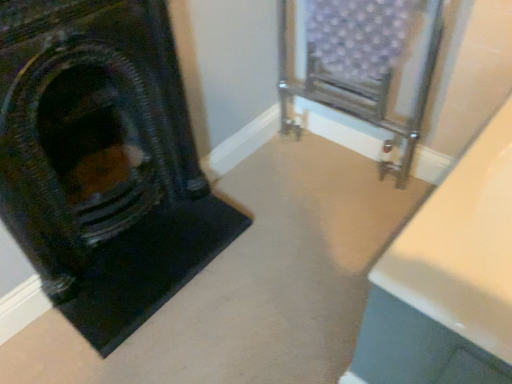
Question: Can you confirm if metallic radiator at center is bigger than matte black fireplace at left?

Choices:
 (A) no
 (B) yes

Answer: (B)

Question: Does metallic radiator at center appear on the right side of matte black fireplace at left?

Choices:
 (A) yes
 (B) no

Answer: (A)

Question: Is metallic radiator at center surrounding matte black fireplace at left?

Choices:
 (A) yes
 (B) no

Answer: (B)

Question: Considering the relative positions of metallic radiator at center and matte black fireplace at left in the image provided, is metallic radiator at center to the left of matte black fireplace at left from the viewer's perspective?

Choices:
 (A) yes
 (B) no

Answer: (B)

Question: Is metallic radiator at center shorter than matte black fireplace at left?

Choices:
 (A) yes
 (B) no

Answer: (A)

Question: Is metallic radiator at center oriented towards matte black fireplace at left?

Choices:
 (A) no
 (B) yes

Answer: (B)

Question: From the image's perspective, would you say matte black fireplace at left is shown under metallic radiator at center?

Choices:
 (A) no
 (B) yes

Answer: (B)

Question: Can you confirm if matte black fireplace at left is positioned to the right of metallic radiator at center?

Choices:
 (A) yes
 (B) no

Answer: (B)

Question: Does matte black fireplace at left come behind metallic radiator at center?

Choices:
 (A) no
 (B) yes

Answer: (A)

Question: Is matte black fireplace at left outside of metallic radiator at center?

Choices:
 (A) yes
 (B) no

Answer: (A)

Question: Does matte black fireplace at left have a larger size compared to metallic radiator at center?

Choices:
 (A) no
 (B) yes

Answer: (A)

Question: From the image's perspective, is matte black fireplace at left located above metallic radiator at center?

Choices:
 (A) no
 (B) yes

Answer: (A)

Question: From their relative heights in the image, would you say metallic radiator at center is taller or shorter than matte black fireplace at left?

Choices:
 (A) tall
 (B) short

Answer: (B)